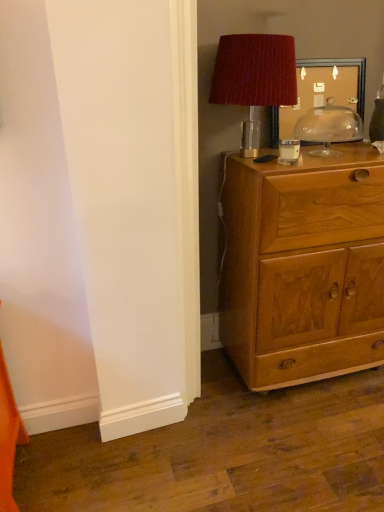
Question: Relative to velvet red lampshade at upper right, is wooden cabinet at right in front or behind?

Choices:
 (A) front
 (B) behind

Answer: (B)

Question: Does point (238, 274) appear closer or farther from the camera than point (273, 75)?

Choices:
 (A) farther
 (B) closer

Answer: (A)

Question: Based on their relative distances, which object is farther from the wooden picture frame at upper right?

Choices:
 (A) velvet red lampshade at upper right
 (B) transparent glass dome at upper right
 (C) wooden cabinet at right

Answer: (C)

Question: Estimate the real-world distances between objects in this image. Which object is closer to the velvet red lampshade at upper right?

Choices:
 (A) transparent glass dome at upper right
 (B) wooden picture frame at upper right
 (C) wooden cabinet at right

Answer: (B)